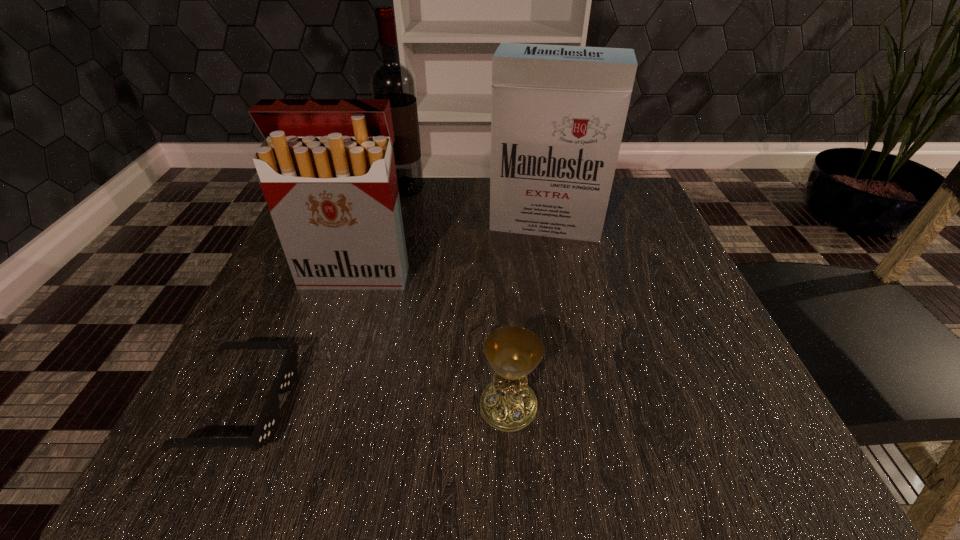
Where is `free space located 0.120m on the right of the second shortest object`? The height and width of the screenshot is (540, 960). free space located 0.120m on the right of the second shortest object is located at coordinates click(625, 406).

Image resolution: width=960 pixels, height=540 pixels. Identify the location of vacant space located 0.350m on the front-facing side of the shortest object. (541, 404).

Image resolution: width=960 pixels, height=540 pixels. I want to click on wine bottle that is at the far edge, so click(391, 80).

At what (x,y) coordinates should I click in order to perform the action: click on cigarette case that is at the far edge. Please return your answer as a coordinate pair (x, y). Looking at the image, I should click on (558, 113).

The width and height of the screenshot is (960, 540). In order to click on chalice situated at the near edge in this screenshot , I will do pos(508,404).

Identify the location of sunglasses at the near edge. (265, 427).

This screenshot has height=540, width=960. I want to click on wine bottle that is positioned at the left edge, so click(391, 80).

Locate an element on the screen. The image size is (960, 540). cigarette case positioned at the left edge is located at coordinates (327, 170).

In order to click on sunglasses present at the left edge in this screenshot , I will do `click(265, 427)`.

Where is `object present at the right edge`? This screenshot has width=960, height=540. object present at the right edge is located at coordinates (558, 113).